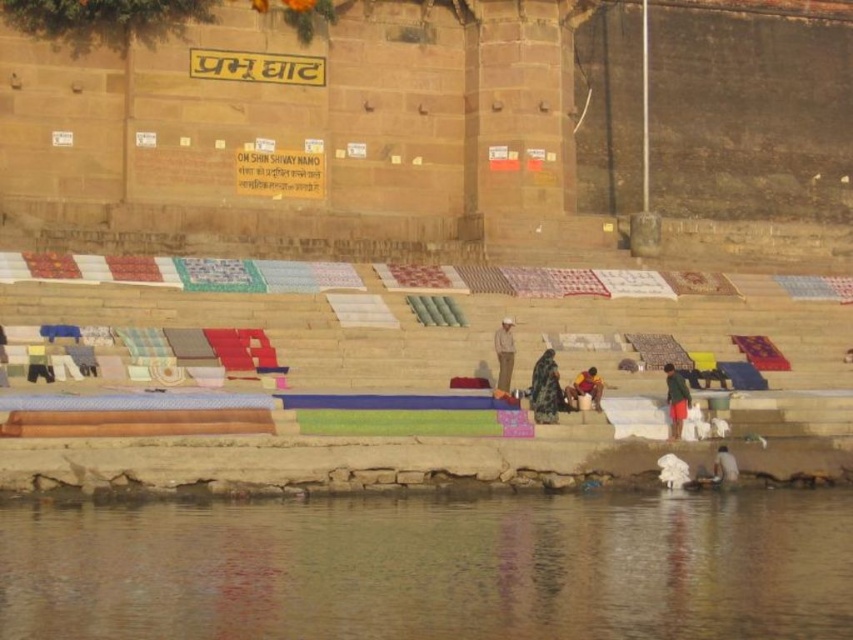
You are standing on the riverside steps and want to pick up the light brown fabric at center and the dark blue fabric at lower right. Which fabric should you reach for first if you want to pick up the one closer to you first?

You should pick up the light brown fabric at center first because it is closer to you than the dark blue fabric at lower right.